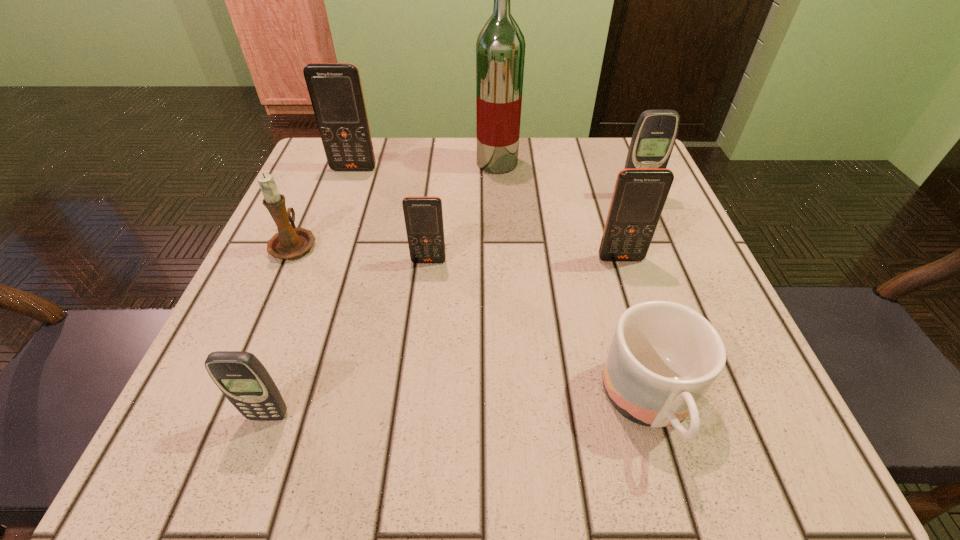
You are a GUI agent. You are given a task and a screenshot of the screen. Output one action in this format:
    pyautogui.click(x=<x>, y=<y>)
    Task: Click on the object at the near right corner
    The image size is (960, 540).
    Given the screenshot: What is the action you would take?
    pyautogui.click(x=664, y=356)

You are a GUI agent. You are given a task and a screenshot of the screen. Output one action in this format:
    pyautogui.click(x=<x>, y=<y>)
    Task: Click on the free region at the far edge of the desktop
    This screenshot has height=540, width=960.
    Given the screenshot: What is the action you would take?
    pyautogui.click(x=397, y=184)

At what (x,y) coordinates should I click in order to perform the action: click on free space at the near edge. Please return your answer as a coordinate pair (x, y). Looking at the image, I should click on (657, 440).

You are a GUI agent. You are given a task and a screenshot of the screen. Output one action in this format:
    pyautogui.click(x=<x>, y=<y>)
    Task: Click on the vacant space at the left edge of the desktop
    
    Given the screenshot: What is the action you would take?
    click(318, 247)

The width and height of the screenshot is (960, 540). I want to click on free location at the right edge of the desktop, so click(x=679, y=252).

You are a GUI agent. You are given a task and a screenshot of the screen. Output one action in this format:
    pyautogui.click(x=<x>, y=<y>)
    Task: Click on the blank space at the far left corner of the desktop
    The image size is (960, 540).
    Given the screenshot: What is the action you would take?
    pyautogui.click(x=341, y=187)

The image size is (960, 540). In order to click on free space at the far right corner of the desktop in this screenshot , I will do `click(616, 166)`.

The image size is (960, 540). I want to click on vacant position at the near right corner of the desktop, so click(x=762, y=424).

Where is `free space between the third farthest object and the fourth object from left to right`? free space between the third farthest object and the fourth object from left to right is located at coordinates [x=533, y=228].

Image resolution: width=960 pixels, height=540 pixels. In order to click on unoccupied position between the farthest cellular telephone and the mug in this screenshot , I will do coord(502,287).